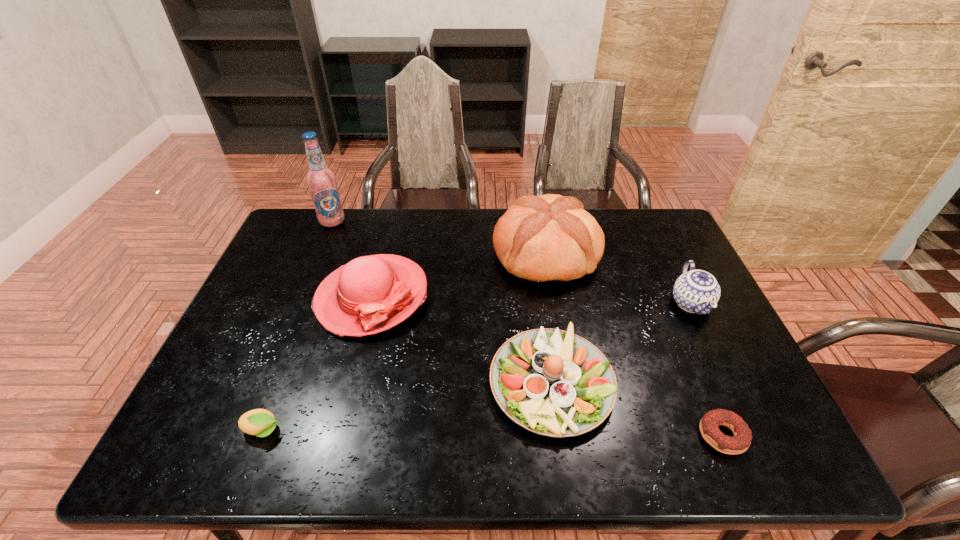
This screenshot has width=960, height=540. Identify the location of free point between the tallest object and the second tallest object. (439, 237).

You are a GUI agent. You are given a task and a screenshot of the screen. Output one action in this format:
    pyautogui.click(x=<x>, y=<y>)
    Task: Click on the vacant space that's between the salad plate and the second tallest object
    This screenshot has width=960, height=540.
    Given the screenshot: What is the action you would take?
    pyautogui.click(x=548, y=317)

This screenshot has height=540, width=960. Find the location of `free spot between the third shortest object and the chinaware`. free spot between the third shortest object and the chinaware is located at coordinates (621, 342).

Locate an element on the screen. The height and width of the screenshot is (540, 960). free area in between the hat and the sixth shortest object is located at coordinates (459, 275).

Identify the location of vacant space that's between the tallest object and the hat. The height and width of the screenshot is (540, 960). (352, 259).

Find the location of a particular element. vacant area between the third shortest object and the shortest object is located at coordinates (x=636, y=408).

The image size is (960, 540). Identify the location of free spot between the chinaware and the salad plate. (621, 342).

Locate an element on the screen. vacant point located between the fifth tallest object and the lemon is located at coordinates (407, 406).

Locate an element on the screen. The image size is (960, 540). vacant area that lies between the chinaware and the third shortest object is located at coordinates (621, 342).

Identify the location of free space between the shortest object and the salad plate. (636, 408).